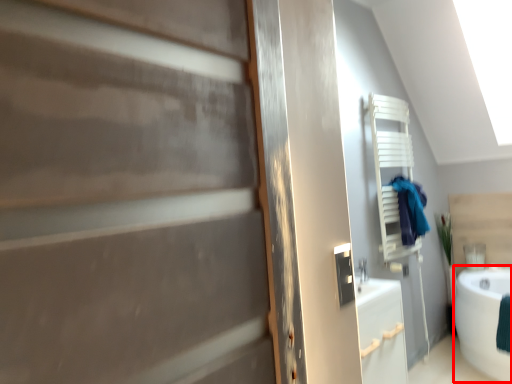
Question: From the image's perspective, where is bath (annotated by the red box) located in relation to laundry in the image?

Choices:
 (A) above
 (B) below

Answer: (B)